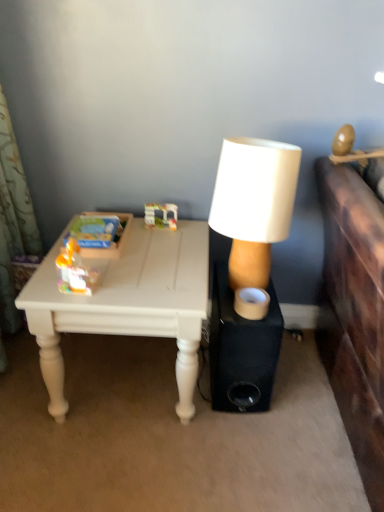
Where is `free spot to the right of translucent plastic toy at center, the 2th toy in the bottom-to-top sequence`? The height and width of the screenshot is (512, 384). free spot to the right of translucent plastic toy at center, the 2th toy in the bottom-to-top sequence is located at coordinates (188, 229).